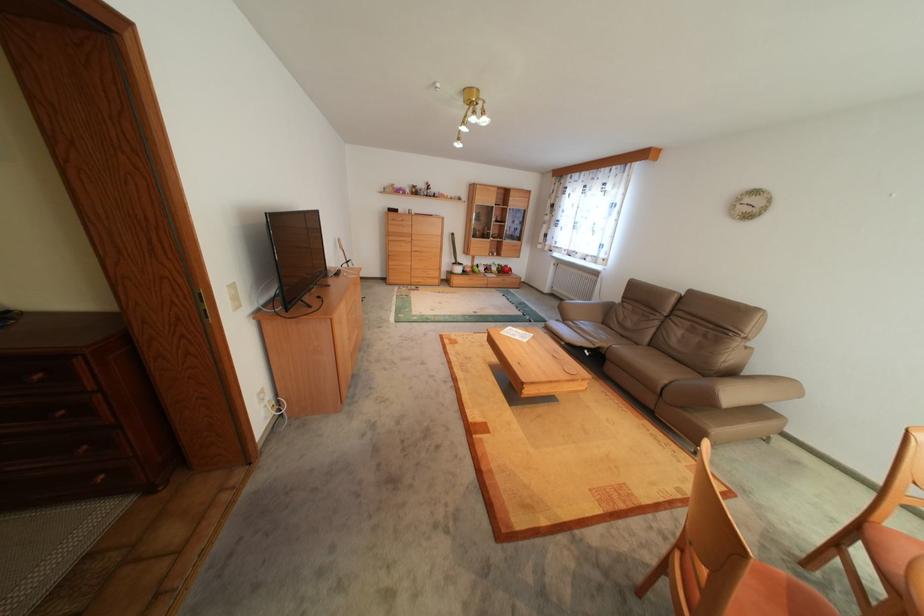
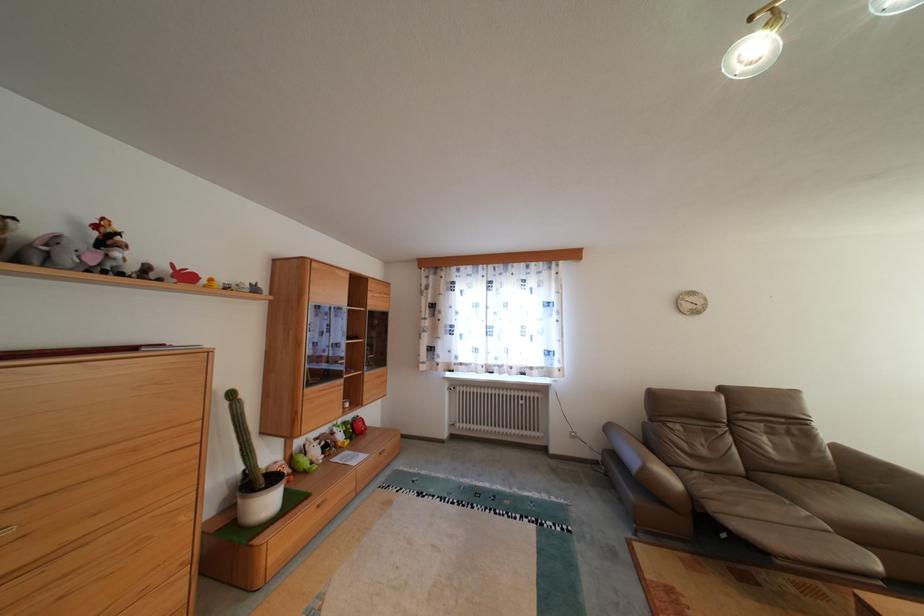
Locate, in the second image, the point that corresponds to pixel 482 265 in the first image.

(301, 460)